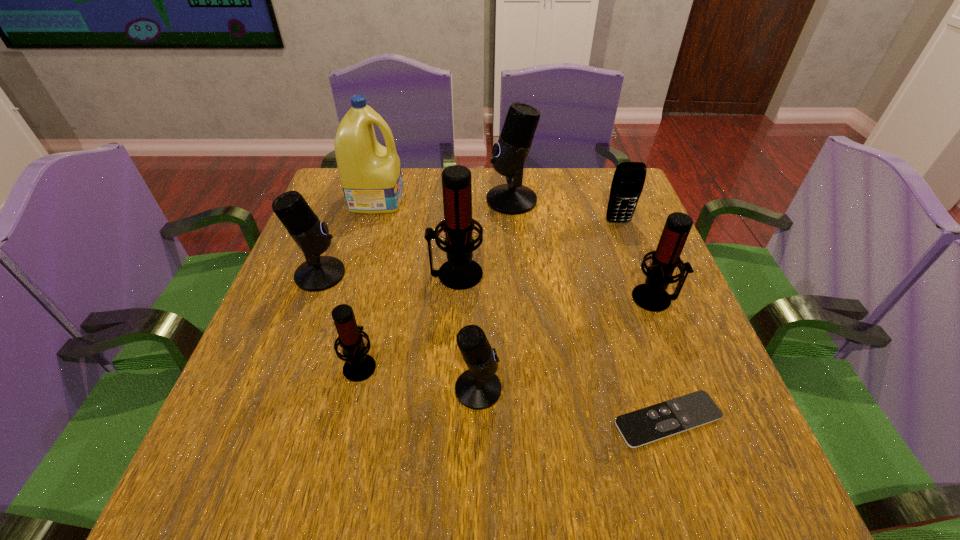
The height and width of the screenshot is (540, 960). In order to click on free space at the near right corner of the desktop in this screenshot , I will do `click(719, 478)`.

Identify the location of free spot between the second red microphone from left to right and the farthest black microphone. (484, 237).

You are a GUI agent. You are given a task and a screenshot of the screen. Output one action in this format:
    pyautogui.click(x=<x>, y=<y>)
    Task: Click on the free spot between the detergent and the smallest red microphone
    
    Given the screenshot: What is the action you would take?
    pyautogui.click(x=369, y=282)

Locate an element on the screen. The image size is (960, 540). free space between the rightmost red microphone and the detergent is located at coordinates (516, 248).

At what (x,y) coordinates should I click in order to perform the action: click on free space between the nearest red microphone and the second red microphone from left to right. Please return your answer as a coordinate pair (x, y). Looking at the image, I should click on (408, 320).

The height and width of the screenshot is (540, 960). What are the coordinates of `blank region between the farthest microphone and the rightmost red microphone` in the screenshot? It's located at (584, 249).

The width and height of the screenshot is (960, 540). I want to click on vacant point located between the smallest red microphone and the biggest red microphone, so 408,320.

At what (x,y) coordinates should I click in order to perform the action: click on unoccupied position between the black remote control and the nearest red microphone. Please return your answer as a coordinate pair (x, y). The image size is (960, 540). Looking at the image, I should click on (514, 392).

Find the location of `vacant region between the rightmost red microphone and the third farthest object`. vacant region between the rightmost red microphone and the third farthest object is located at coordinates (636, 260).

This screenshot has width=960, height=540. In order to click on empty space that is in between the cellular telephone and the leftmost red microphone in this screenshot , I will do `click(490, 293)`.